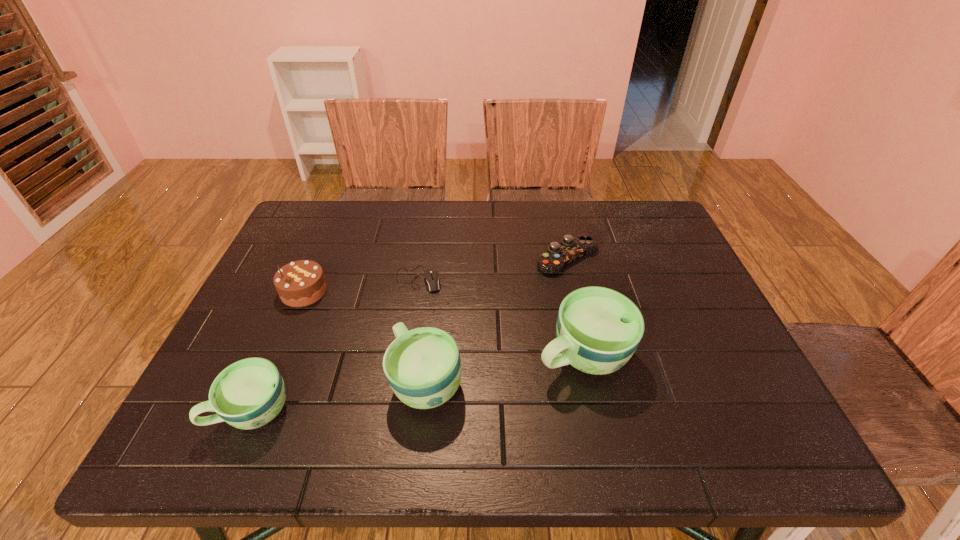
Locate an element on the screen. The width and height of the screenshot is (960, 540). cup that stands as the second closest to the second tallest object is located at coordinates (248, 394).

This screenshot has width=960, height=540. I want to click on vacant area that satisfies the following two spatial constraints: 1. on the back side of the leftmost cup; 2. on the left side of the fifth tallest object, so click(x=319, y=258).

You are a GUI agent. You are given a task and a screenshot of the screen. Output one action in this format:
    pyautogui.click(x=<x>, y=<y>)
    Task: Click on the vacant area that satisfies the following two spatial constraints: 1. on the back side of the leftmost cup; 2. on the left side of the shortest object
    The width and height of the screenshot is (960, 540).
    Given the screenshot: What is the action you would take?
    pyautogui.click(x=309, y=279)

Locate an element on the screen. free spot that satisfies the following two spatial constraints: 1. on the back side of the control; 2. on the right side of the second tallest object is located at coordinates (440, 258).